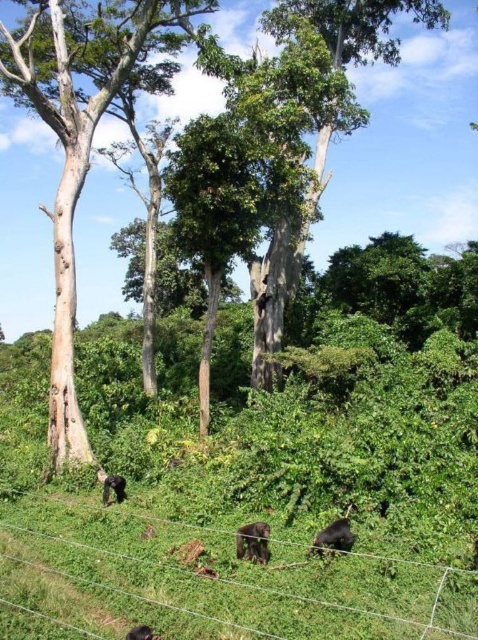
You are navigating through a forest and need to reach a specific point. You see two points marked in the scene. Which point is closer to you, the point at coordinates point (x=239, y=557) or the point at coordinates point (x=340, y=548)?

The point at coordinates point (x=239, y=557) is closer to you because it is further to the viewer than point (x=340, y=548).

You are a hiker who wants to take a photo of the dark brown fur gorilla at lower center without the smooth light brown tree trunk at left blocking the view. Is the gorilla visible from your current position?

The smooth light brown tree trunk at left is taller than the dark brown fur gorilla at lower center, so the tree trunk may block part of the gorilla from view depending on your angle. Move to a position where the gorilla is not directly behind the tree trunk to get a clear shot.

You are a hiker navigating through the forest and want to reach a point in the scene. You have two options, point A at coordinates point [113,67] and point B at coordinates point [133,634]. Which point is closer to your current position?

Point A at coordinates point [113,67] is closer to your current position because it is further to the viewer than point B at coordinates point [133,634].